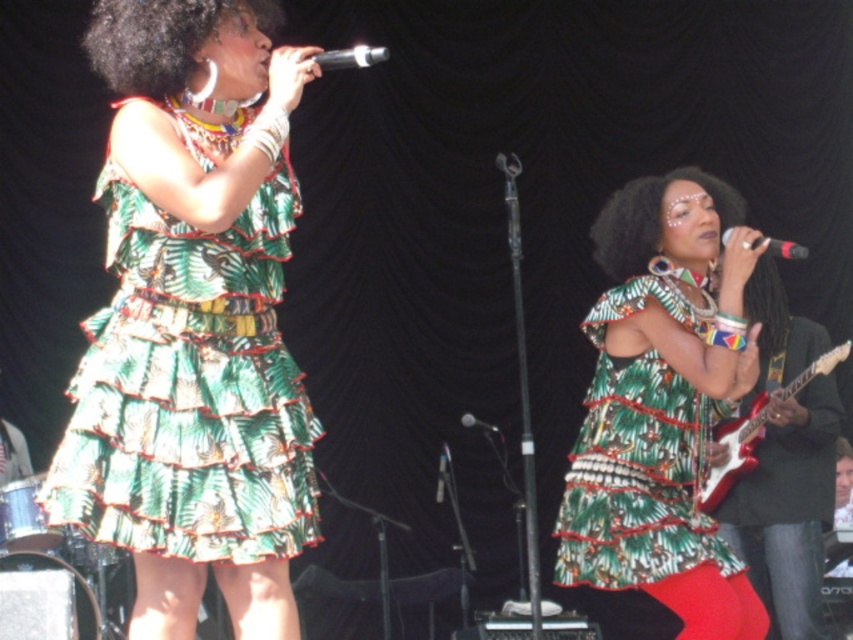
You are a photographer standing in front of the stage. You want to take a closeup photo of the green leafy fabric dress at left. The camera you have can focus on objects within 3 meters. Will you be able to take the photo without moving closer?

The green leafy fabric dress at left is 3.48 meters away from the viewer. Since the camera can only focus within 3 meters, you need to move closer to take the closeup photo.

You are a photographer preparing to capture a closeup shot of the two women on stage. You need to ensure that both the curly hair at upper left and the green textured fabric afro at center are clearly visible in the frame. Based on their sizes, which of these two hair styles would require you to adjust your camera focus more carefully to avoid blurriness?

The curly hair at upper left has a smaller size compared to the green textured fabric afro at center, so it would require more careful focus adjustment to ensure clarity in the photograph.